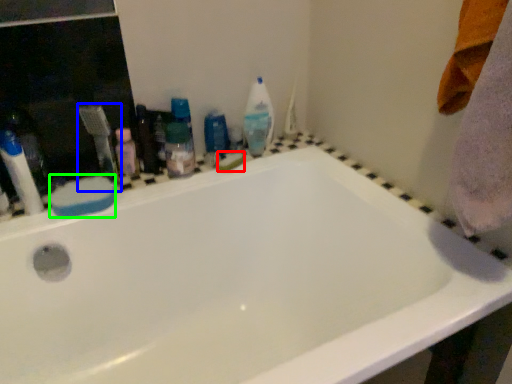
Question: Which object is positioned farthest from soap (highlighted by a red box)? Select from toothbrush (highlighted by a blue box) and soap (highlighted by a green box).

Choices:
 (A) toothbrush
 (B) soap

Answer: (B)